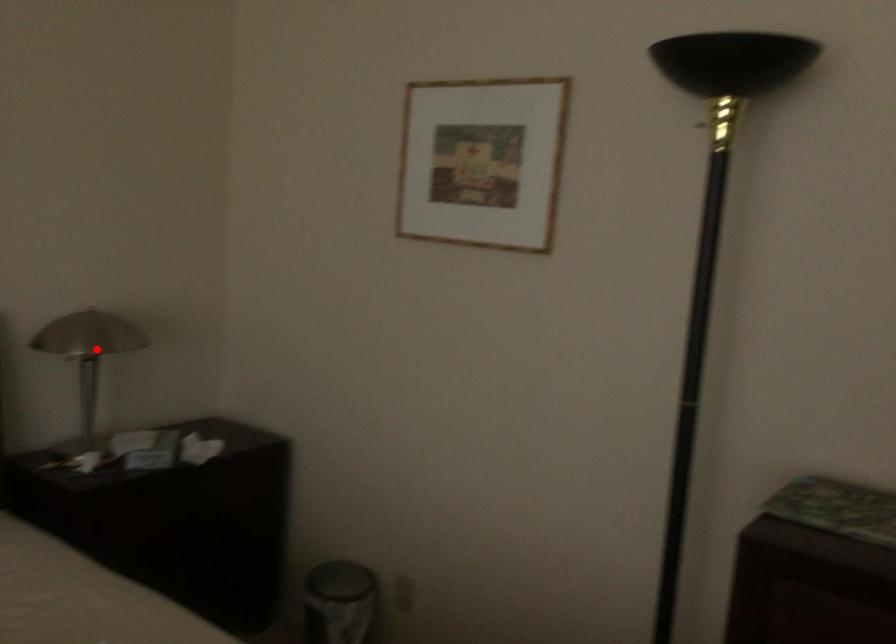
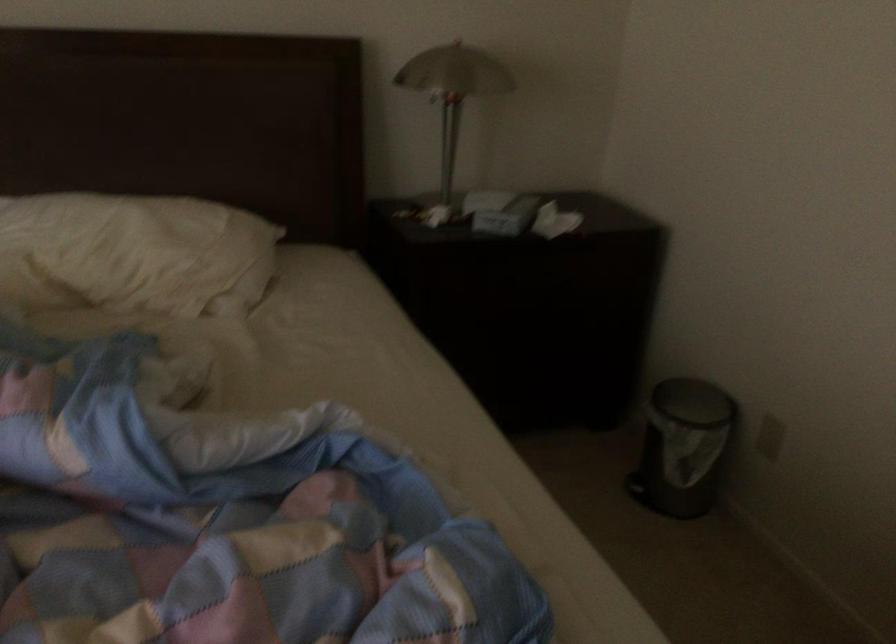
Find the pixel in the second image that matches the highlighted location in the first image.

(453, 91)